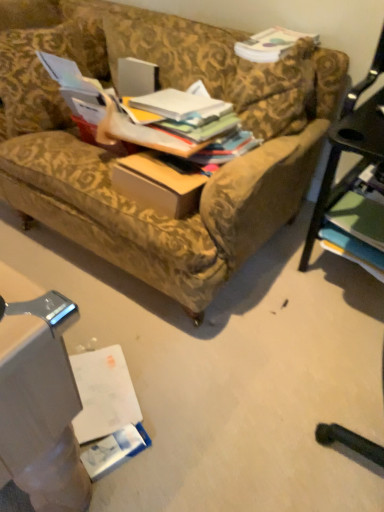
Question: Is white paper book at center, the second book in the top-to-bottom sequence, taller or shorter than green matte book at lower right, which appears as the fifth book when viewed from the top?

Choices:
 (A) short
 (B) tall

Answer: (A)

Question: Is white paper book at center, the second book in the top-to-bottom sequence, wider or thinner than green matte book at lower right, the 1th book when ordered from bottom to top?

Choices:
 (A) thin
 (B) wide

Answer: (A)

Question: Which is farther from the matte white book at upper center, the 5th book from the bottom?

Choices:
 (A) multicolored paper stack at center, the 3th book from the top
 (B) multicolored paper stack at center, positioned as the 2th book in bottom-to-top order
 (C) green matte book at lower right, the 1th book when ordered from bottom to top
 (D) white paper book at center, the 4th book from the bottom

Answer: (C)

Question: Which object is positioned closest to the multicolored paper stack at center, positioned as the 2th book in bottom-to-top order?

Choices:
 (A) matte white book at upper center, the 5th book from the bottom
 (B) white paper book at center, the 4th book from the bottom
 (C) green matte book at lower right, which appears as the fifth book when viewed from the top
 (D) multicolored paper stack at center, the 3th book from the top

Answer: (D)